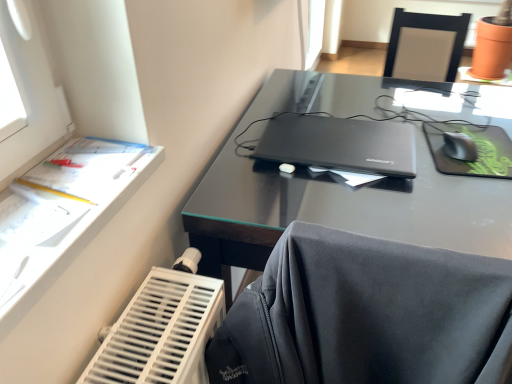
The width and height of the screenshot is (512, 384). What are the coordinates of `free space on the front side of black matte mouse pad at right` in the screenshot? It's located at (473, 196).